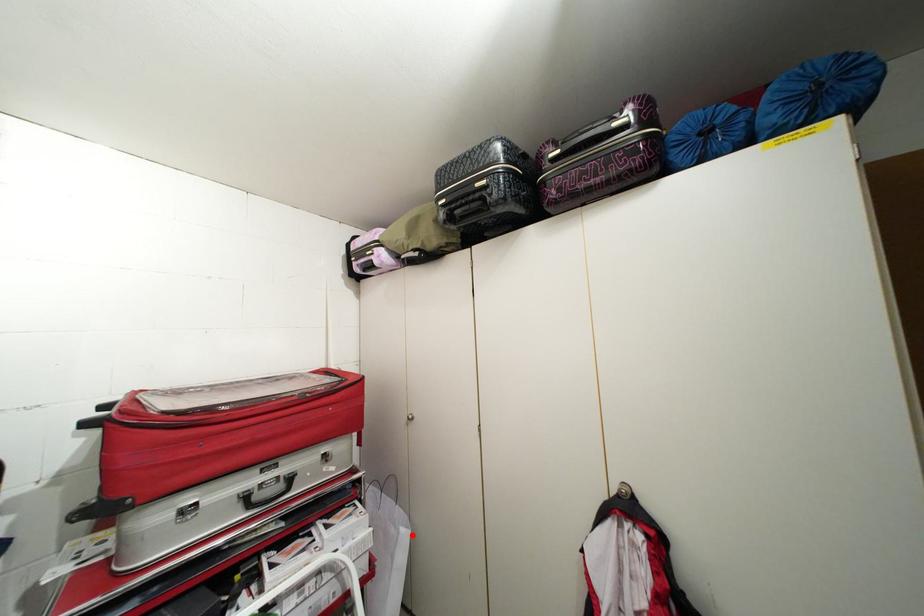
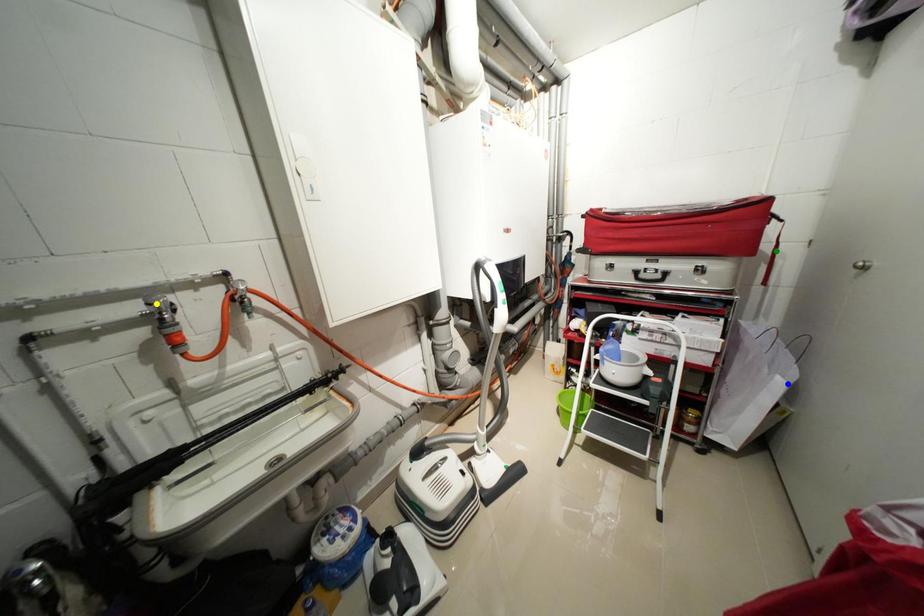
Question: I am providing you with two images of the same scene from different viewpoints. A red point is marked on the first image. You are given multiple points on the second image. Which mark in image 2 goes with the point in image 1?

Choices:
 (A) yellow point
 (B) green point
 (C) blue point

Answer: (C)